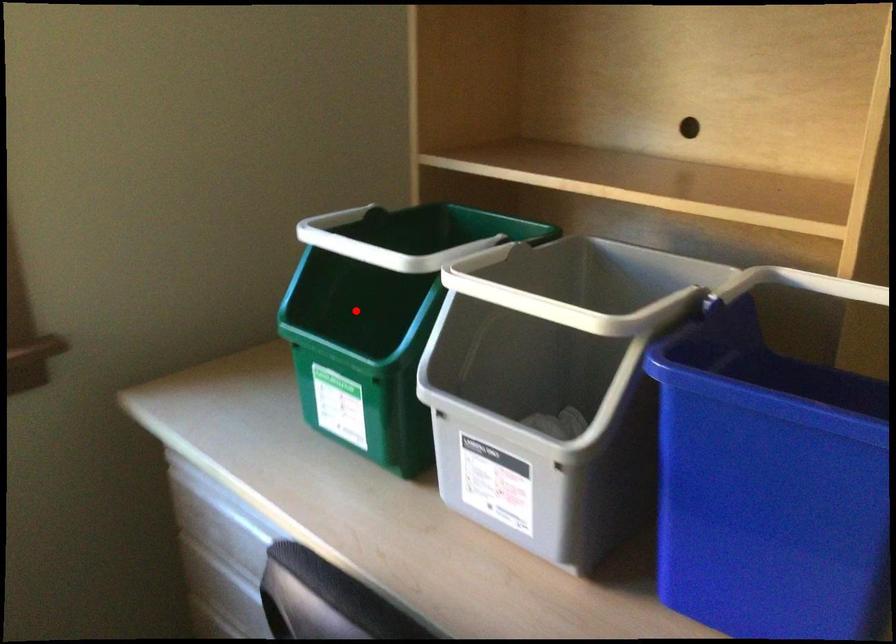
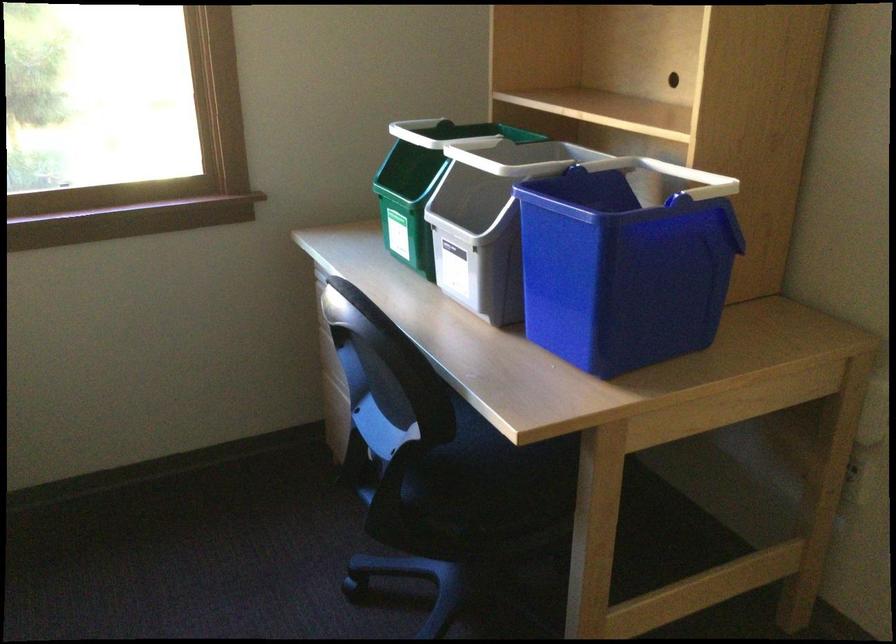
Question: I am providing you with two images of the same scene from different viewpoints. In image1, a red point is highlighted. Considering the same 3D point in image2, which of the following is correct?

Choices:
 (A) It is closer
 (B) It is farther

Answer: (B)